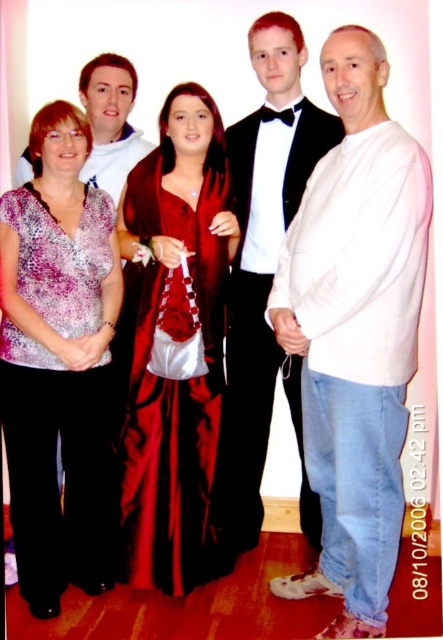
Question: Among these points, which one is farthest from the camera?

Choices:
 (A) (335, 189)
 (B) (131, 579)
 (C) (225, 401)
 (D) (100, 573)

Answer: (C)

Question: Does matte pink blouse at left appear on the left side of satin dress at center?

Choices:
 (A) no
 (B) yes

Answer: (B)

Question: Which of the following is the farthest from the observer?

Choices:
 (A) white cotton shirt at right
 (B) matte pink blouse at left
 (C) satin dress at center

Answer: (C)

Question: Does matte pink blouse at left lie in front of satin dress at center?

Choices:
 (A) no
 (B) yes

Answer: (B)

Question: Does matte pink blouse at left have a greater width compared to satin dress at center?

Choices:
 (A) yes
 (B) no

Answer: (B)

Question: Which of these objects is positioned farthest from the matte pink blouse at left?

Choices:
 (A) matte white tuxedo at upper center
 (B) white satin tuxedo at center

Answer: (B)